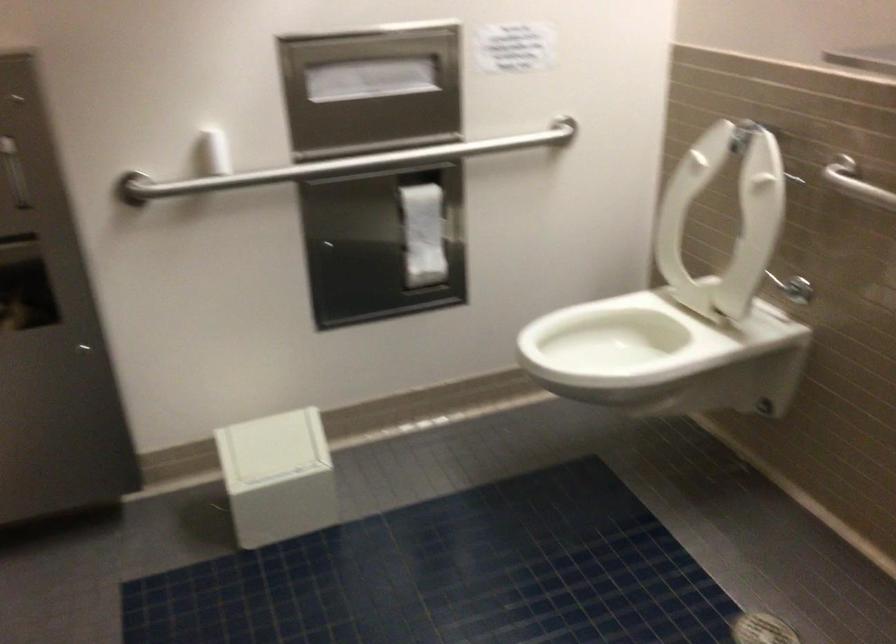
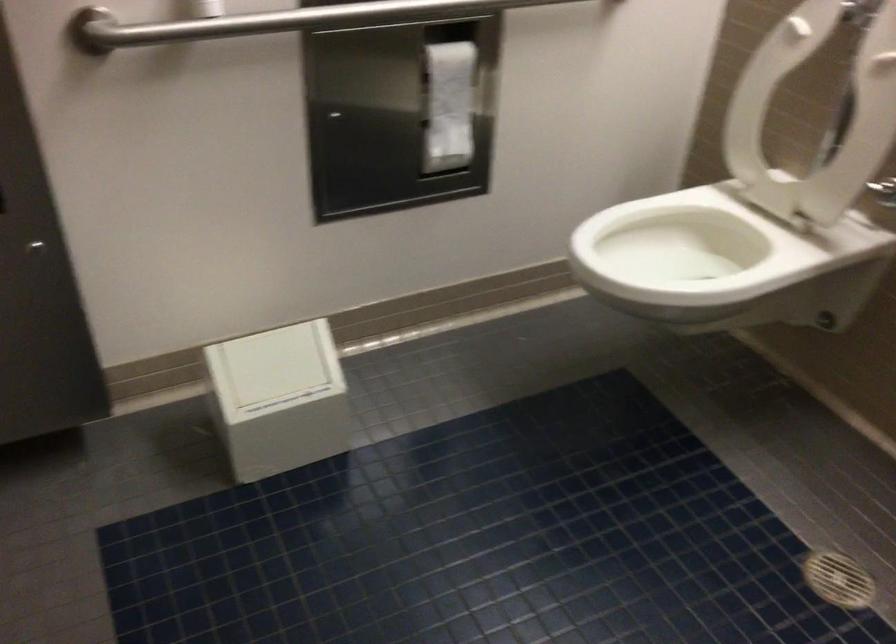
In the second image, find the point that corresponds to point (425, 225) in the first image.

(450, 98)